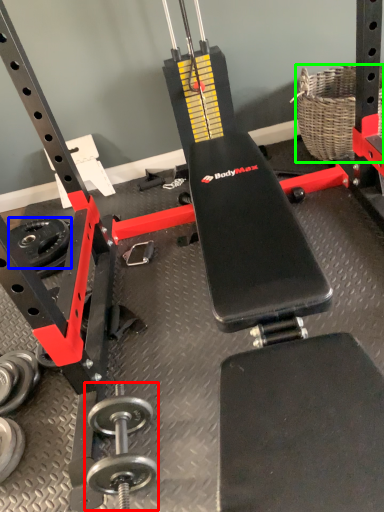
Question: Which object is positioned farthest from dumbbell (highlighted by a red box)? Select from wheel (highlighted by a blue box) and basket (highlighted by a green box).

Choices:
 (A) wheel
 (B) basket

Answer: (B)